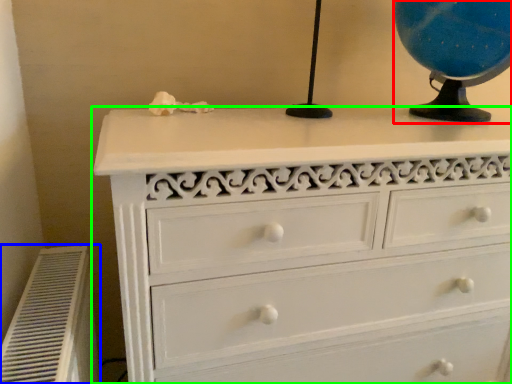
Question: Considering the real-world distances, which object is farthest from table lamp (highlighted by a red box)? air conditioner (highlighted by a blue box) or chest of drawers (highlighted by a green box)?

Choices:
 (A) air conditioner
 (B) chest of drawers

Answer: (A)